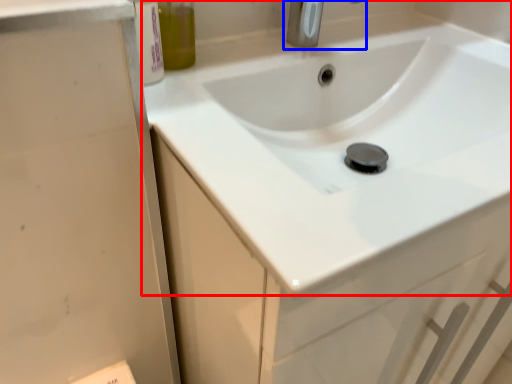
Question: Which of the following is the closest to the observer, sink (highlighted by a red box) or tap (highlighted by a blue box)?

Choices:
 (A) sink
 (B) tap

Answer: (A)